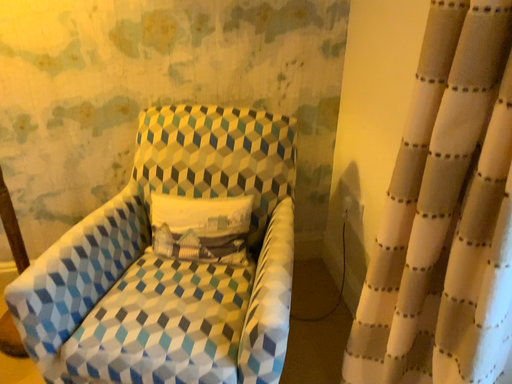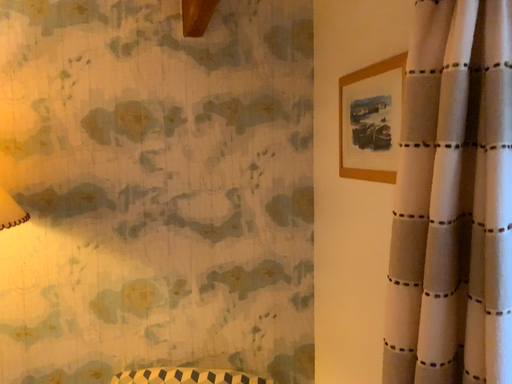
Question: Which way did the camera rotate in the video?

Choices:
 (A) rotated downward
 (B) rotated upward

Answer: (B)